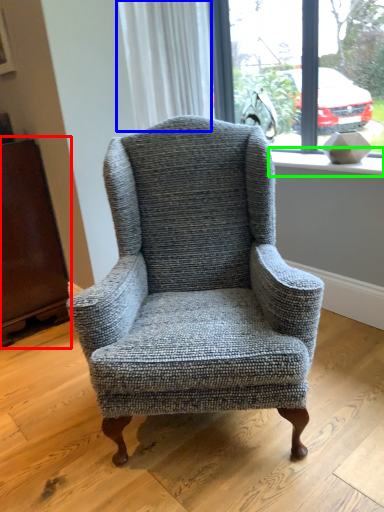
Question: Which object is positioned farthest from armoire (highlighted by a red box)? Select from curtain (highlighted by a blue box) and window sill (highlighted by a green box).

Choices:
 (A) curtain
 (B) window sill

Answer: (B)